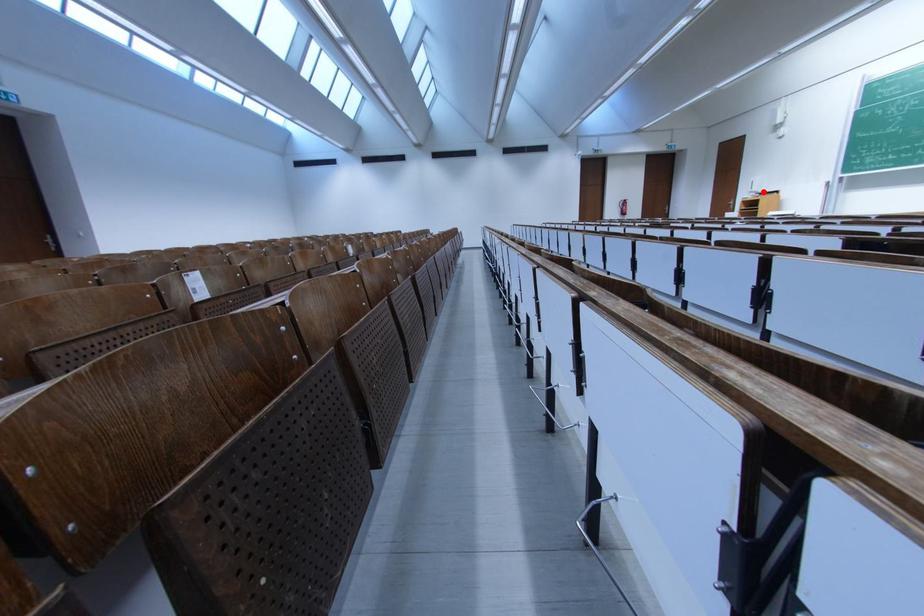
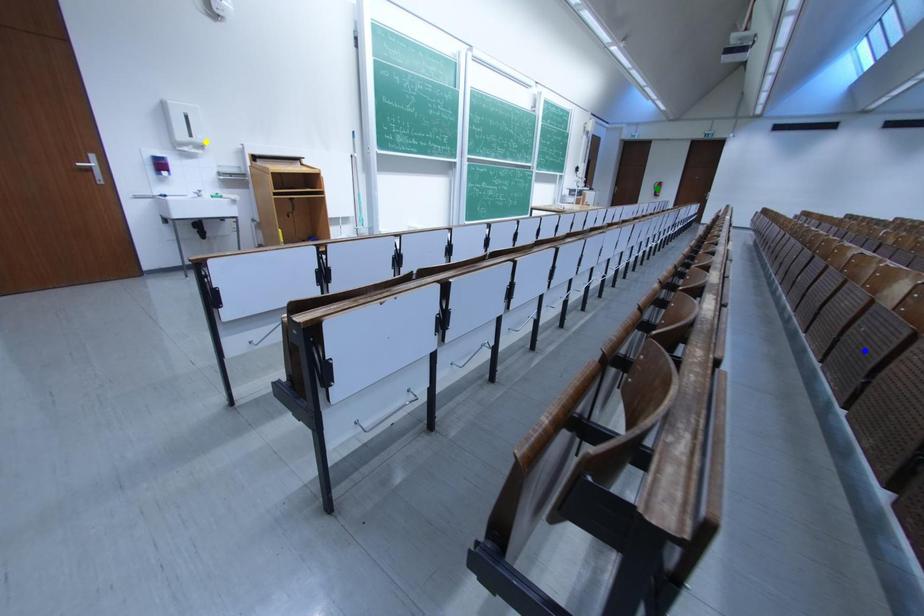
Question: I am providing you with two images of the same scene from different viewpoints. A red point is marked on the first image. You are given multiple points on the second image. Which point in image 2 represents the same 3d spot as the red point in image 1?

Choices:
 (A) green point
 (B) yellow point
 (C) blue point

Answer: (B)